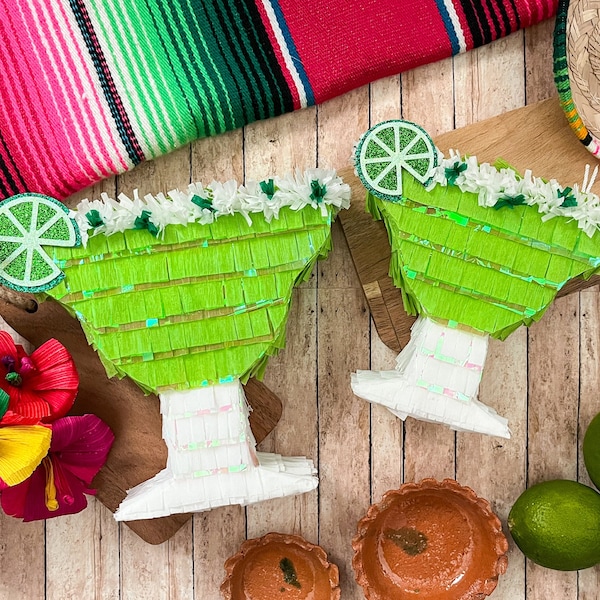
The width and height of the screenshot is (600, 600). I want to click on mexican blanket, so click(x=286, y=65).